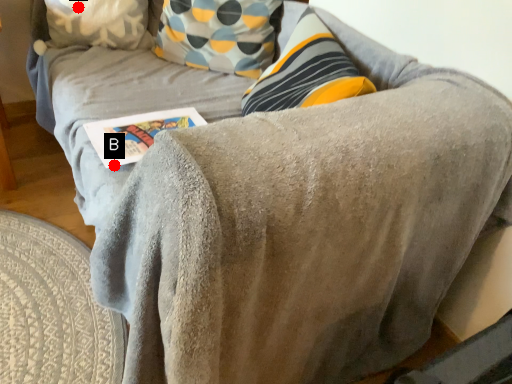
Question: Two points are circled on the image, labeled by A and B beside each circle. Which point is closer to the camera?

Choices:
 (A) A is closer
 (B) B is closer

Answer: (B)